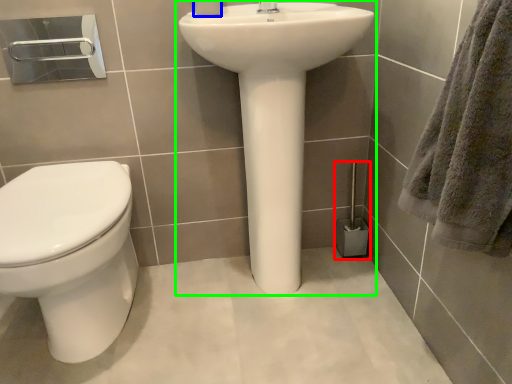
Question: Which object is the closest to the brush (highlighted by a red box)? Choose among these: toilet paper (highlighted by a blue box) or sink (highlighted by a green box).

Choices:
 (A) toilet paper
 (B) sink

Answer: (B)